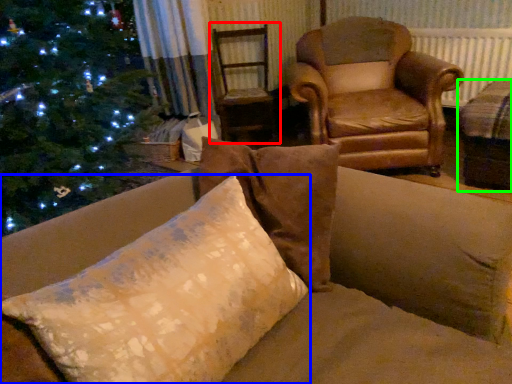
Question: Based on their relative distances, which object is nearer to swivel chair (highlighted by a red box)? Choose from pillow (highlighted by a blue box) and beige (highlighted by a green box).

Choices:
 (A) pillow
 (B) beige

Answer: (B)